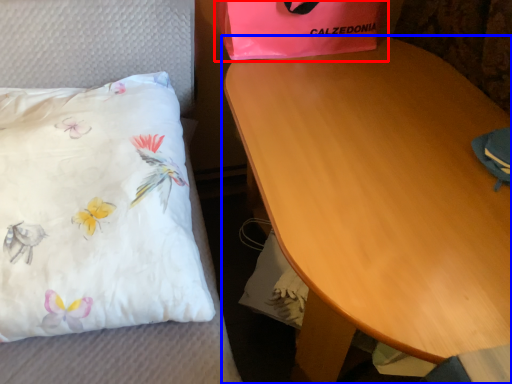
Question: Which object appears farthest to the camera in this image, gift bag (highlighted by a red box) or table (highlighted by a blue box)?

Choices:
 (A) gift bag
 (B) table

Answer: (A)